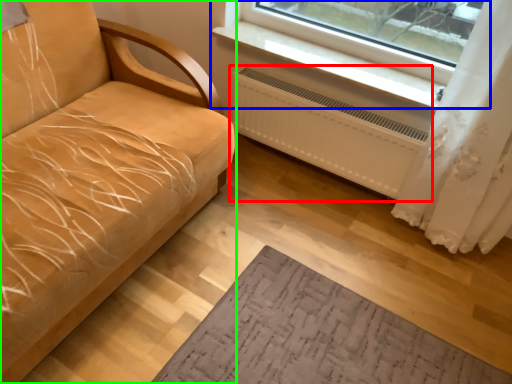
Question: Which is farther away from radiator (highlighted by a red box)? window (highlighted by a blue box) or studio couch (highlighted by a green box)?

Choices:
 (A) window
 (B) studio couch

Answer: (B)